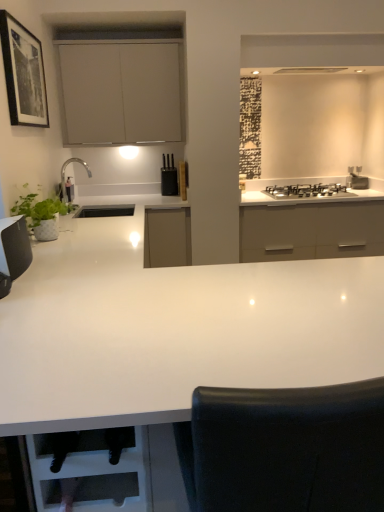
Question: Does white glossy countertop at center have a greater height compared to black glass gas stove at upper right?

Choices:
 (A) no
 (B) yes

Answer: (B)

Question: Is white glossy countertop at center shorter than black glass gas stove at upper right?

Choices:
 (A) yes
 (B) no

Answer: (B)

Question: Does white glossy countertop at center lie in front of black glass gas stove at upper right?

Choices:
 (A) no
 (B) yes

Answer: (B)

Question: From a real-world perspective, is white glossy countertop at center on top of black glass gas stove at upper right?

Choices:
 (A) no
 (B) yes

Answer: (A)

Question: From a real-world perspective, is white glossy countertop at center positioned under black glass gas stove at upper right based on gravity?

Choices:
 (A) yes
 (B) no

Answer: (A)

Question: Does white glossy countertop at center touch black glass gas stove at upper right?

Choices:
 (A) yes
 (B) no

Answer: (B)

Question: Considering the relative sizes of black matte knife block at upper center and satin silver stove at upper right in the image provided, is black matte knife block at upper center smaller than satin silver stove at upper right?

Choices:
 (A) yes
 (B) no

Answer: (B)

Question: Does black matte knife block at upper center touch satin silver stove at upper right?

Choices:
 (A) no
 (B) yes

Answer: (A)

Question: From a real-world perspective, is black matte knife block at upper center beneath satin silver stove at upper right?

Choices:
 (A) yes
 (B) no

Answer: (B)

Question: Does black matte knife block at upper center contain satin silver stove at upper right?

Choices:
 (A) no
 (B) yes

Answer: (A)

Question: Is black matte knife block at upper center looking in the opposite direction of satin silver stove at upper right?

Choices:
 (A) no
 (B) yes

Answer: (A)

Question: Considering the relative positions of black matte knife block at upper center and satin silver stove at upper right in the image provided, is black matte knife block at upper center to the right of satin silver stove at upper right from the viewer's perspective?

Choices:
 (A) yes
 (B) no

Answer: (B)

Question: Could you tell me if matte white cabinet at upper center is facing green matte plant at left?

Choices:
 (A) no
 (B) yes

Answer: (B)